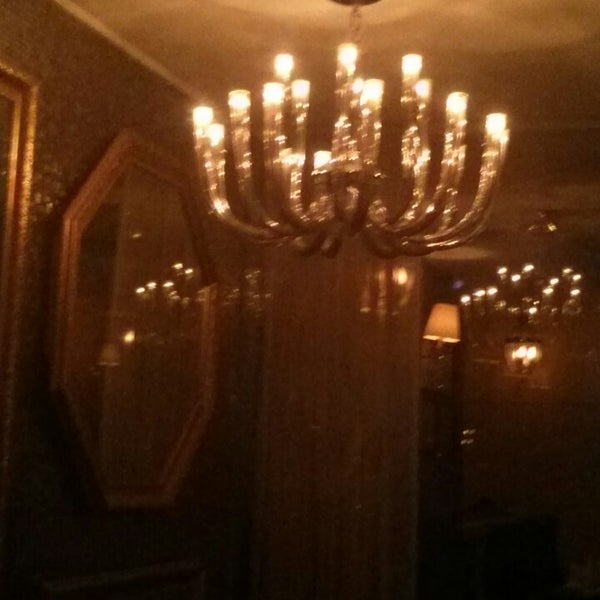
You are a GUI agent. You are given a task and a screenshot of the screen. Output one action in this format:
    pyautogui.click(x=<x>, y=<y>)
    Task: Click on the left side of mirror
    Image resolution: width=600 pixels, height=600 pixels.
    Given the screenshot: What is the action you would take?
    pyautogui.click(x=61, y=293)